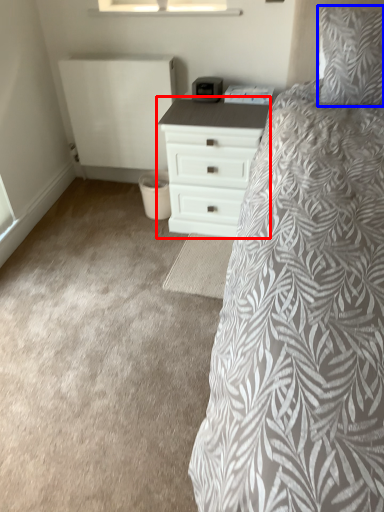
Question: Among these objects, which one is farthest to the camera, chest of drawers (highlighted by a red box) or pillow (highlighted by a blue box)?

Choices:
 (A) chest of drawers
 (B) pillow

Answer: (A)